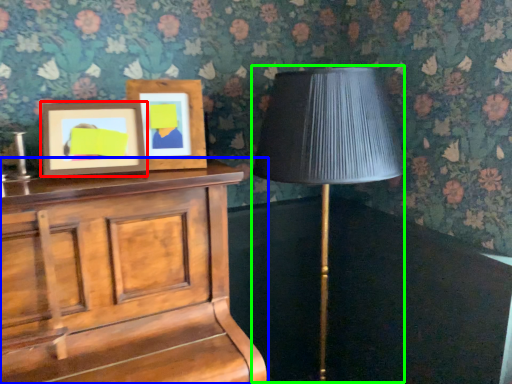
Question: Considering the real-world distances, which object is closest to picture frame (highlighted by a red box)? furniture (highlighted by a blue box) or table lamp (highlighted by a green box).

Choices:
 (A) furniture
 (B) table lamp

Answer: (A)